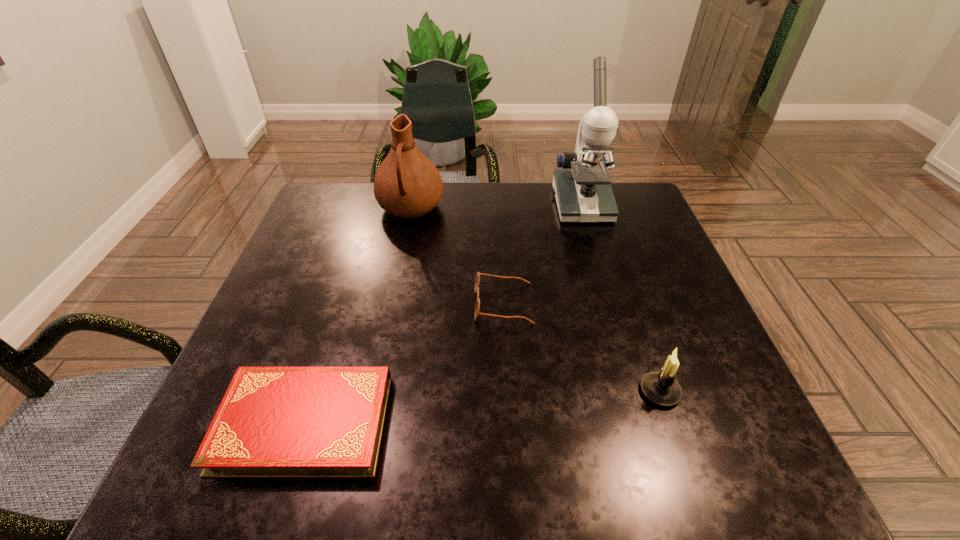
Locate an element on the screen. free space between the third tallest object and the microscope is located at coordinates (620, 298).

This screenshot has width=960, height=540. In order to click on free space between the shortest object and the third shortest object in this screenshot , I will do `click(482, 407)`.

Find the location of a particular element. Image resolution: width=960 pixels, height=540 pixels. free space between the third shortest object and the tallest object is located at coordinates coord(620,298).

At what (x,y) coordinates should I click in order to perform the action: click on free spot between the pitcher and the microscope. Please return your answer as a coordinate pair (x, y). Image resolution: width=960 pixels, height=540 pixels. Looking at the image, I should click on (496, 206).

Identify the location of free space that is in between the pitcher and the fourth tallest object. point(457,256).

At what (x,y) coordinates should I click in order to perform the action: click on free spot between the spectacles and the microscope. Please return your answer as a coordinate pair (x, y). Looking at the image, I should click on (542, 254).

Choose which object is the third nearest neighbor to the microscope. Please provide its 2D coordinates. Your answer should be formatted as a tuple, i.e. [(x, y)], where the tuple contains the x and y coordinates of a point satisfying the conditions above.

[(660, 387)]

Select which object appears as the third closest to the third object from right to left. Please provide its 2D coordinates. Your answer should be formatted as a tuple, i.e. [(x, y)], where the tuple contains the x and y coordinates of a point satisfying the conditions above.

[(407, 184)]

At what (x,y) coordinates should I click in order to perform the action: click on vacant region that satisfies the following two spatial constraints: 1. on the side of the fourth shortest object with the handle; 2. on the right side of the candle holder. Please return your answer as a coordinate pair (x, y). The image size is (960, 540). Looking at the image, I should click on (373, 391).

At what (x,y) coordinates should I click in order to perform the action: click on vacant point that satisfies the following two spatial constraints: 1. on the side of the fourth shortest object with the handle; 2. on the left side of the third shortest object. Please return your answer as a coordinate pair (x, y). Looking at the image, I should click on (373, 391).